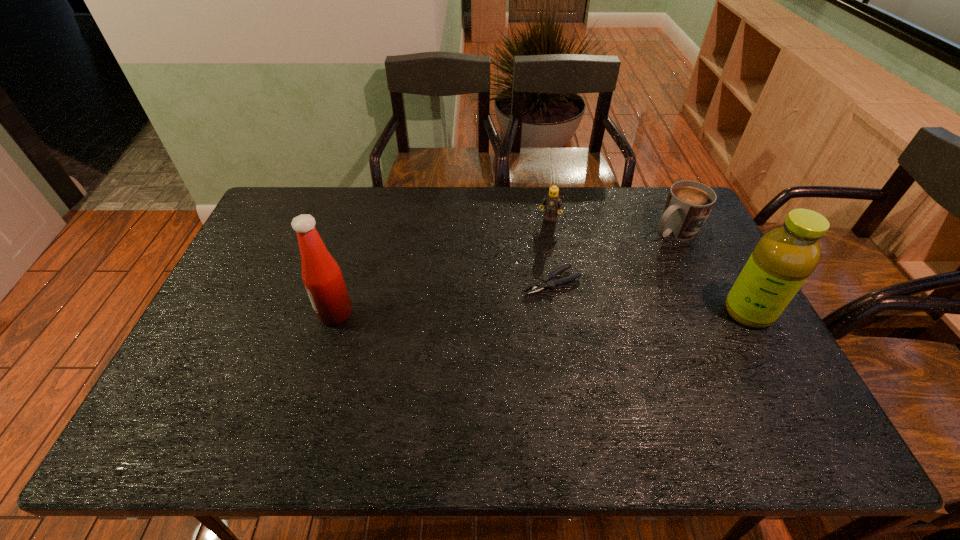
Identify the location of unoccupied position between the condiment and the mug. This screenshot has height=540, width=960. (504, 272).

Where is `free space between the fruit juice and the condiment`? The width and height of the screenshot is (960, 540). free space between the fruit juice and the condiment is located at coordinates (541, 313).

This screenshot has height=540, width=960. I want to click on empty location between the Lego and the fruit juice, so click(649, 266).

Where is `vacant space that is in between the Lego and the mug`? vacant space that is in between the Lego and the mug is located at coordinates (612, 225).

I want to click on unoccupied area between the fruit juice and the mug, so click(710, 272).

This screenshot has height=540, width=960. I want to click on vacant space that is in between the condiment and the Lego, so click(443, 266).

Where is `free point between the condiment and the fruit juice`? The height and width of the screenshot is (540, 960). free point between the condiment and the fruit juice is located at coordinates coord(541,313).

Find the location of a particular element. the closest object to the mug is located at coordinates (782, 260).

Locate an element on the screen. The height and width of the screenshot is (540, 960). object that is the fourth nearest to the mug is located at coordinates (322, 277).

The image size is (960, 540). What are the coordinates of `vacant space that satisfies the following two spatial constraints: 1. on the front side of the fruit juice; 2. on the front label of the Lego` in the screenshot? It's located at (565, 312).